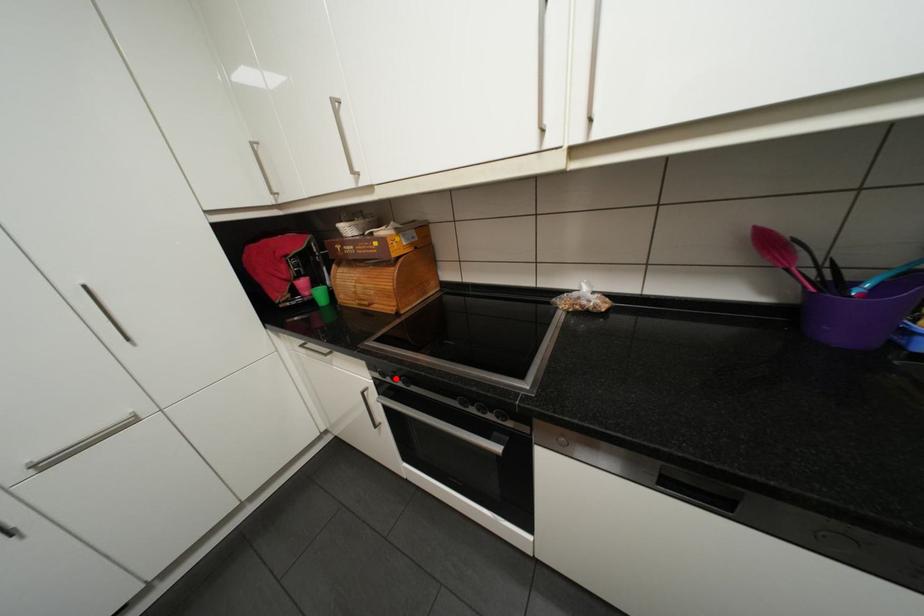
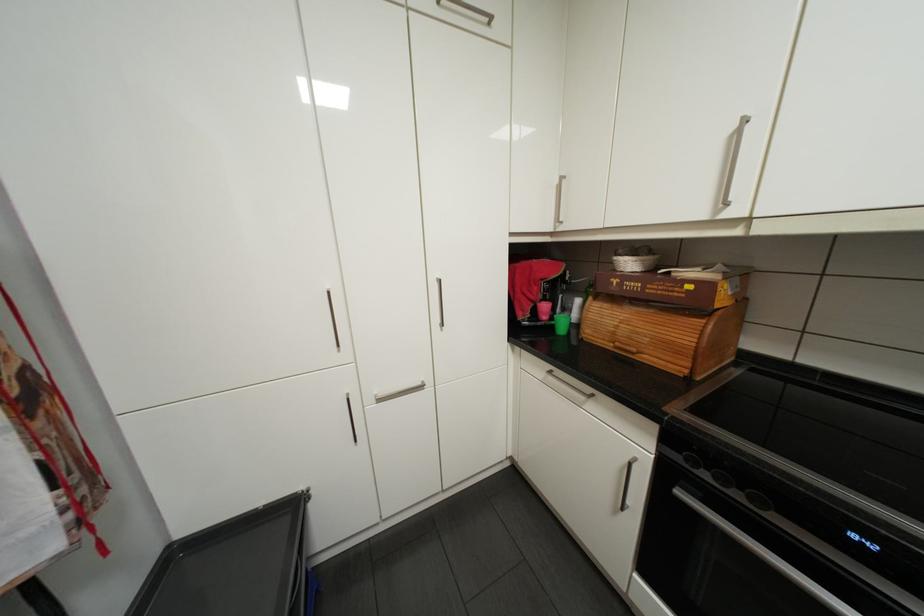
Question: I am providing you with two images of the same scene from different viewpoints. In image1, a red point is highlighted. Considering the same 3D point in image2, which of the following is correct?

Choices:
 (A) It is closer
 (B) It is farther

Answer: (A)